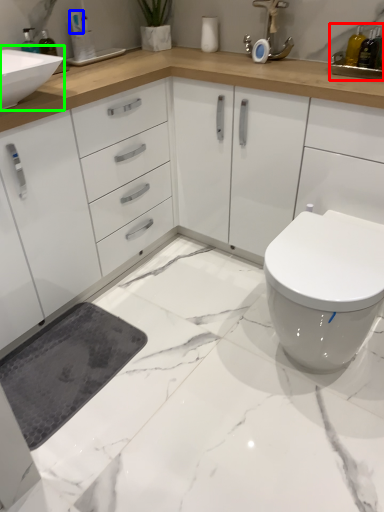
Question: Which object is the closest to the sink (highlighted by a red box)? Choose among these: toiletry (highlighted by a blue box) or sink (highlighted by a green box).

Choices:
 (A) toiletry
 (B) sink

Answer: (B)